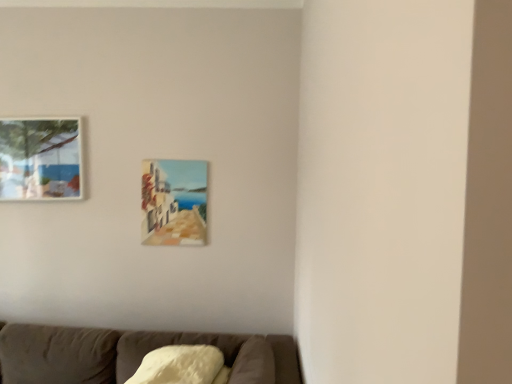
Question: Is matte glass picture frame at upper left, the first picture frame positioned from the left, wider or thinner than matte wooden picture frame at center, the first picture frame when ordered from right to left?

Choices:
 (A) thin
 (B) wide

Answer: (B)

Question: In terms of height, does matte glass picture frame at upper left, which appears as the 2th picture frame when viewed from the right, look taller or shorter compared to matte wooden picture frame at center, positioned as the second picture frame in left-to-right order?

Choices:
 (A) tall
 (B) short

Answer: (B)

Question: In the image, is matte glass picture frame at upper left, the first picture frame positioned from the left, positioned in front of or behind matte wooden picture frame at center, positioned as the second picture frame in left-to-right order?

Choices:
 (A) front
 (B) behind

Answer: (A)

Question: Considering the positions of matte wooden picture frame at center, positioned as the second picture frame in left-to-right order, and matte glass picture frame at upper left, which appears as the 2th picture frame when viewed from the right, in the image, is matte wooden picture frame at center, positioned as the second picture frame in left-to-right order, wider or thinner than matte glass picture frame at upper left, which appears as the 2th picture frame when viewed from the right,?

Choices:
 (A) thin
 (B) wide

Answer: (A)

Question: Relative to matte glass picture frame at upper left, the first picture frame positioned from the left, is matte wooden picture frame at center, the first picture frame when ordered from right to left, in front or behind?

Choices:
 (A) front
 (B) behind

Answer: (B)

Question: Is point (193, 198) positioned closer to the camera than point (30, 129)?

Choices:
 (A) closer
 (B) farther

Answer: (B)

Question: From a real-world perspective, is matte wooden picture frame at center, the first picture frame when ordered from right to left, positioned above or below matte glass picture frame at upper left, the first picture frame positioned from the left?

Choices:
 (A) above
 (B) below

Answer: (B)